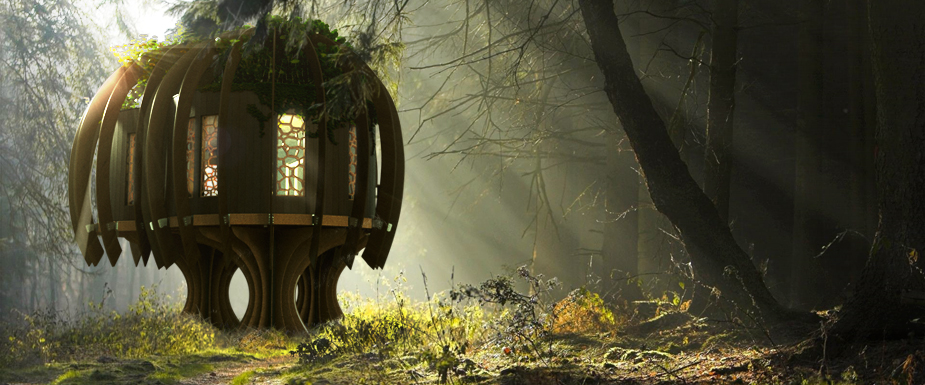
Identify the location of sunbeam hitting plant. (399, 306), (364, 308), (593, 313).